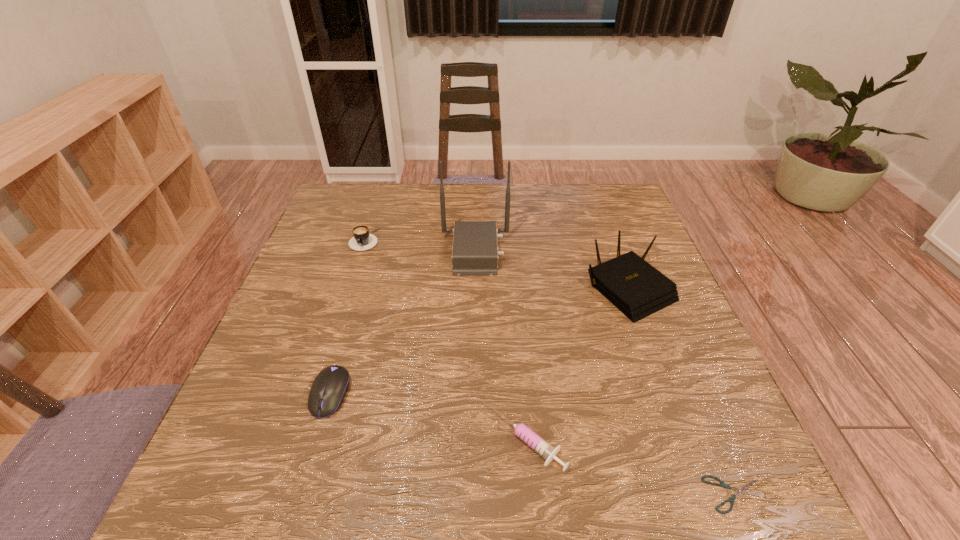
Identify the location of the taller router. The width and height of the screenshot is (960, 540). (474, 253).

Identify the location of the tallest object. The height and width of the screenshot is (540, 960). (474, 253).

At what (x,y) coordinates should I click in order to perform the action: click on the shorter router. Please return your answer as a coordinate pair (x, y). The height and width of the screenshot is (540, 960). Looking at the image, I should click on (636, 288).

The height and width of the screenshot is (540, 960). In order to click on the second tallest object in this screenshot , I will do `click(636, 288)`.

Image resolution: width=960 pixels, height=540 pixels. Identify the location of cappuccino. (362, 240).

Where is `the third shortest object`? the third shortest object is located at coordinates (329, 388).

Find the location of a particular element. This screenshot has width=960, height=540. syringe is located at coordinates (543, 448).

Find the location of a particular element. This screenshot has width=960, height=540. the shortest object is located at coordinates (743, 489).

Identify the location of the nearest object. (743, 489).

Find the location of a particular element. This screenshot has height=540, width=960. free space located on the back of the left router to connect cables is located at coordinates (542, 252).